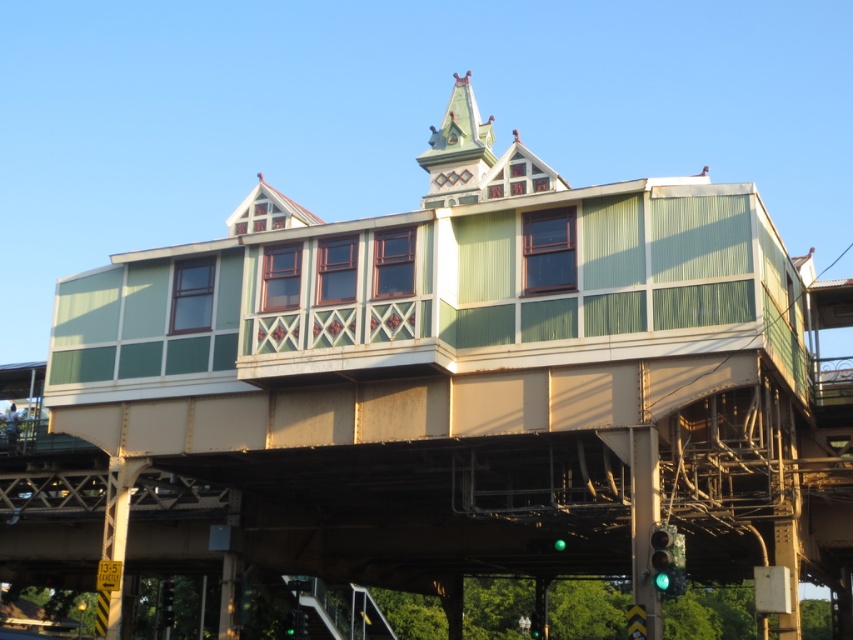
Between green glass traffic light at lower right and green glass traffic light at lower center, which one appears on the left side from the viewer's perspective?

green glass traffic light at lower right is more to the left.

Between point (660, 589) and point (540, 612), which one is positioned behind?

Positioned behind is point (540, 612).

Is point (674, 540) less distant than point (543, 627)?

Yes, point (674, 540) is closer to viewer.

Identify the location of green glass traffic light at lower right. The height and width of the screenshot is (640, 853). (666, 561).

Who is more distant from viewer, (654, 536) or (166, 582)?

The point (166, 582) is behind.

Does green glass traffic light at lower right have a lesser width compared to green glass traffic light at upper center?

Correct, green glass traffic light at lower right's width is less than green glass traffic light at upper center's.

Image resolution: width=853 pixels, height=640 pixels. What do you see at coordinates (666, 561) in the screenshot?
I see `green glass traffic light at lower right` at bounding box center [666, 561].

Where is `green glass traffic light at lower right`? green glass traffic light at lower right is located at coordinates (666, 561).

Which is more to the left, green glass traffic light at upper center or green glass traffic light at lower center?

From the viewer's perspective, green glass traffic light at upper center appears more on the left side.

From the picture: Between green glass traffic light at upper center and green glass traffic light at lower center, which one is positioned higher?

green glass traffic light at upper center is above.

Is point (170, 600) in front of point (535, 637)?

No.

The width and height of the screenshot is (853, 640). In order to click on green glass traffic light at upper center in this screenshot , I will do `click(166, 604)`.